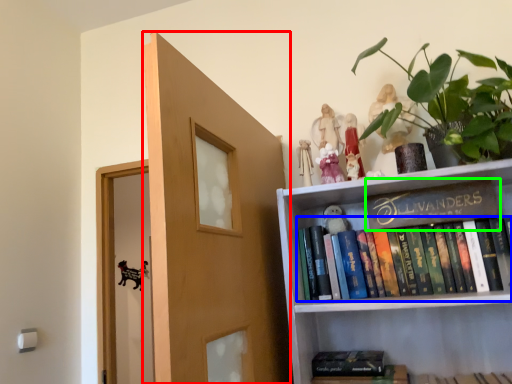
Question: Based on their relative distances, which object is farther from door (highlighted by a red box)? Choose from book (highlighted by a blue box) and book (highlighted by a green box).

Choices:
 (A) book
 (B) book

Answer: (B)